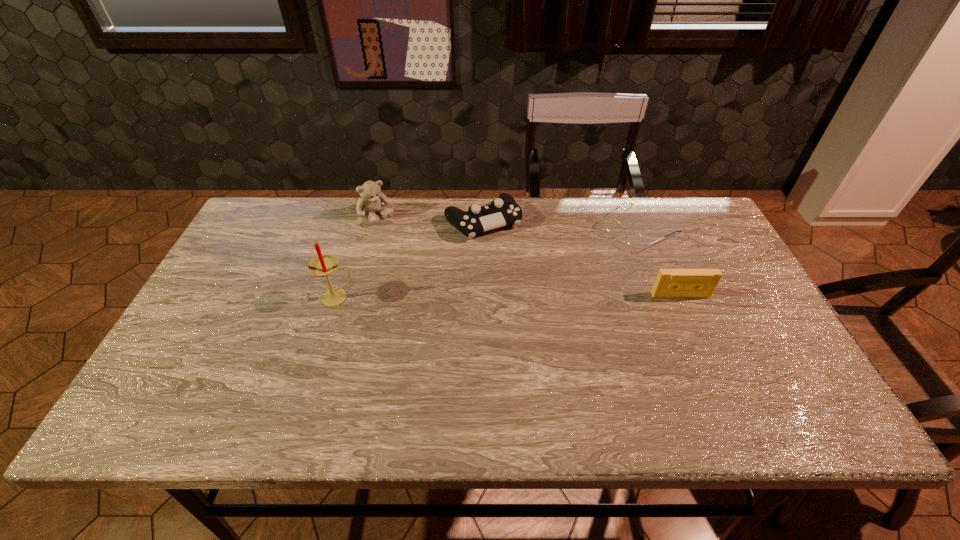
Identify the location of candle. (322, 266).

Where is `videotape`? This screenshot has width=960, height=540. videotape is located at coordinates (670, 283).

Where is `spectacles`? Image resolution: width=960 pixels, height=540 pixels. spectacles is located at coordinates (634, 239).

The width and height of the screenshot is (960, 540). I want to click on control, so click(503, 211).

This screenshot has width=960, height=540. Find the location of `teddy bear`. teddy bear is located at coordinates (371, 198).

This screenshot has width=960, height=540. Find the location of `vacant area situated on the back of the candle`. vacant area situated on the back of the candle is located at coordinates (349, 255).

What are the coordinates of `free region located at the front of the videotape with spools` in the screenshot? It's located at (711, 367).

You are a GUI agent. You are given a task and a screenshot of the screen. Output one action in this format:
    pyautogui.click(x=<x>, y=<y>)
    Task: Click on the free spot located through the lenses of the spectacles
    
    Given the screenshot: What is the action you would take?
    pyautogui.click(x=521, y=303)

This screenshot has width=960, height=540. I want to click on free region located through the lenses of the spectacles, so [598, 255].

This screenshot has height=540, width=960. In order to click on vacant space located through the lenses of the spectacles in this screenshot , I will do `click(588, 261)`.